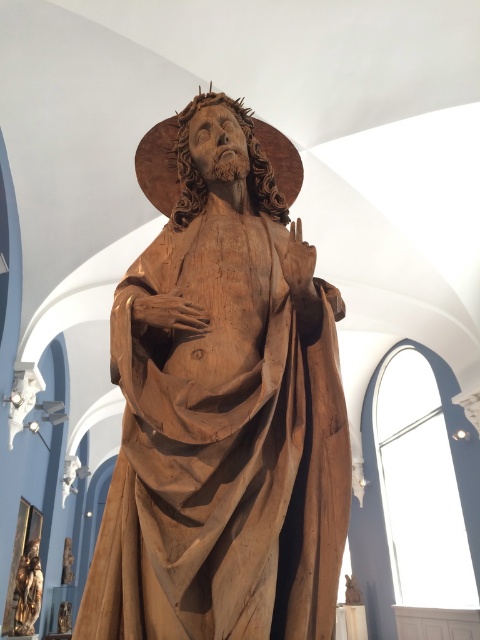
Question: Which point is farther to the camera?

Choices:
 (A) wooden statue at center
 (B) gold polished statue at lower left

Answer: (B)

Question: Is wooden statue at center closer to camera compared to gold polished statue at lower left?

Choices:
 (A) no
 (B) yes

Answer: (B)

Question: Is wooden statue at center smaller than gold polished statue at lower left?

Choices:
 (A) yes
 (B) no

Answer: (B)

Question: Which point is closer to the camera?

Choices:
 (A) (320, 280)
 (B) (33, 605)

Answer: (A)

Question: Where is wooden statue at center located in relation to gold polished statue at lower left in the image?

Choices:
 (A) above
 (B) below

Answer: (A)

Question: Which point is farther to the camera?

Choices:
 (A) wooden statue at center
 (B) gold polished statue at lower left

Answer: (B)